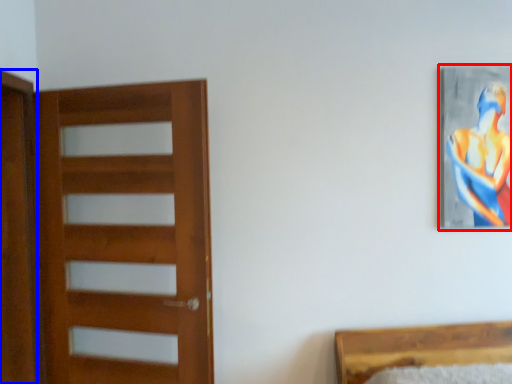
Question: Which point is further to the camera, picture frame (highlighted by a red box) or screen door (highlighted by a blue box)?

Choices:
 (A) picture frame
 (B) screen door

Answer: (A)